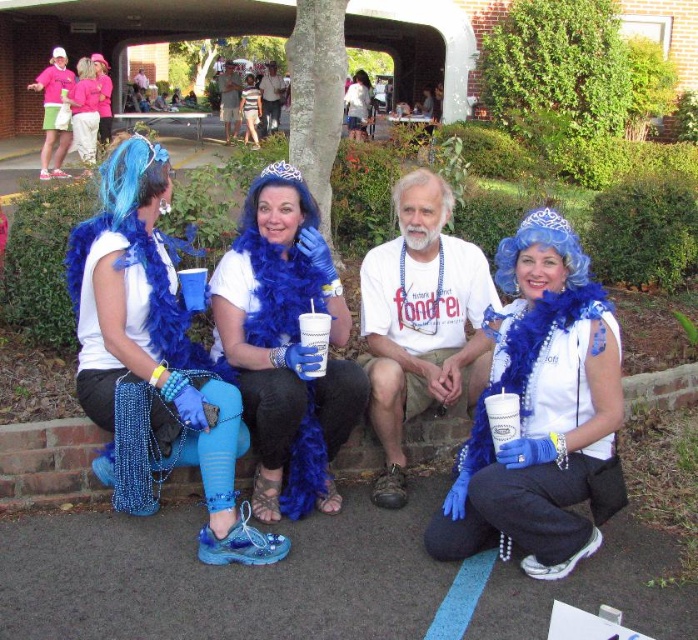
You are standing at the covered area where the group is sitting. You need to locate two specific points marked in the image. The first point is at coordinates point (64, 88) and the second is at point (363, 108). Which point is closer to you?

Point (64, 88) is in front of point (363, 108), so it is closer to you.

You are at a park event and see two items at the center of the image. The blue feather boa at center and the matte plastic cup at center. Which one is positioned to the left?

The blue feather boa at center is to the left of the matte plastic cup at center.

You are at an outdoor event and see two items at the center of the scene. The blue feather boa at center and the matte plastic cup at center. Which item is taller?

The matte plastic cup at center is taller than the blue feather boa at center.